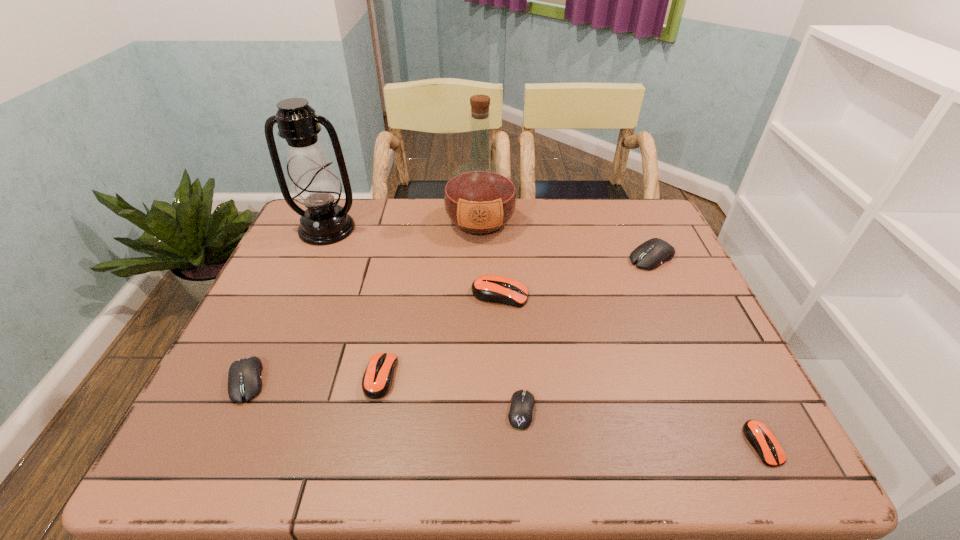
Locate an element on the screen. free space at the far left corner of the desktop is located at coordinates (299, 239).

What are the coordinates of `vacant space that's between the fifth computer mouse from right to left and the fifth nearest computer mouse` in the screenshot? It's located at (441, 336).

The height and width of the screenshot is (540, 960). What are the coordinates of `free point between the rightmost orange computer mouse and the second smallest black computer equipment` in the screenshot? It's located at (505, 413).

Identify the location of free space between the pink liquor and the rightmost orange computer mouse. [x=621, y=333].

At what (x,y) coordinates should I click in order to perform the action: click on unoccupied position between the rightmost black computer equipment and the rightmost orange computer mouse. Please return your answer as a coordinate pair (x, y). The image size is (960, 540). Looking at the image, I should click on (708, 350).

Image resolution: width=960 pixels, height=540 pixels. I want to click on free area in between the second orange computer mouse from right to left and the oil lamp, so click(x=414, y=262).

Find the location of a particular element. The width and height of the screenshot is (960, 540). vacant area that lies between the nearest orange computer mouse and the leftmost computer mouse is located at coordinates (505, 413).

You are a GUI agent. You are given a task and a screenshot of the screen. Output one action in this format:
    pyautogui.click(x=<x>, y=<y>)
    Task: Click on the vacant region between the nearest orange computer mouse and the oil lamp
    This screenshot has height=540, width=960.
    Given the screenshot: What is the action you would take?
    pyautogui.click(x=544, y=336)

Locate an element on the screen. This screenshot has width=960, height=540. empty space between the black oil lamp and the leftmost black computer equipment is located at coordinates (287, 305).

I want to click on unoccupied position between the liquor and the smallest black computer equipment, so click(501, 316).